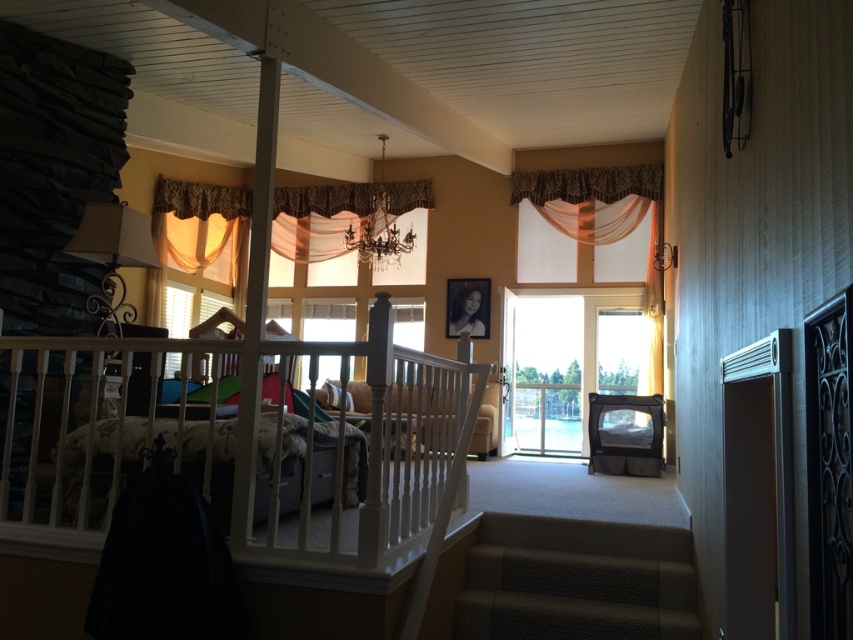
Question: Which of the following is the farthest from the observer?

Choices:
 (A) clear glass door at center
 (B) matte brown valance at upper center
 (C) carpeted stairs at lower center

Answer: (B)

Question: Does white wooden porch at lower left lie behind carpeted stairs at lower center?

Choices:
 (A) no
 (B) yes

Answer: (A)

Question: Which is farther from the carpeted stairs at lower center?

Choices:
 (A) sheer orange fabric at upper left
 (B) white wooden porch at lower left

Answer: (A)

Question: Is white wooden porch at lower left below matte brown valance at upper center?

Choices:
 (A) no
 (B) yes

Answer: (B)

Question: Is sheer orange fabric at upper left thinner than matte brown valance at upper center?

Choices:
 (A) yes
 (B) no

Answer: (B)

Question: Which of the following is the farthest from the observer?

Choices:
 (A) (503, 323)
 (B) (172, 435)

Answer: (A)